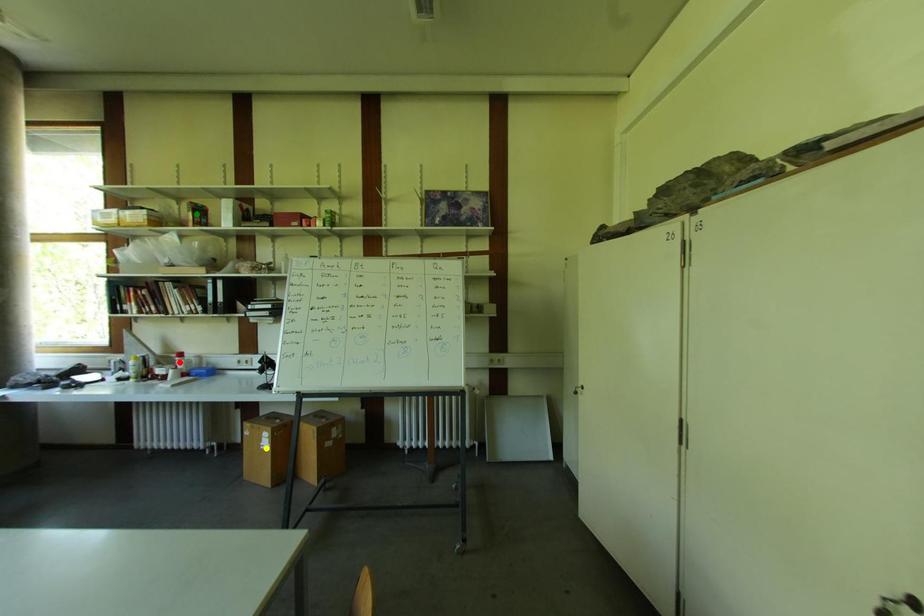
Order these from nearest to farthest:
- green point
- yellow point
- red point

1. yellow point
2. green point
3. red point